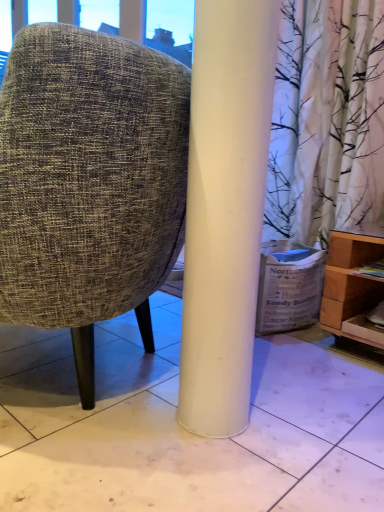
Question: From the image's perspective, would you say white glossy tile at center is positioned over light brown wooden shelf at lower right?

Choices:
 (A) yes
 (B) no

Answer: (B)

Question: Is white glossy tile at center taller than light brown wooden shelf at lower right?

Choices:
 (A) no
 (B) yes

Answer: (A)

Question: Is white glossy tile at center smaller than light brown wooden shelf at lower right?

Choices:
 (A) no
 (B) yes

Answer: (A)

Question: Is white glossy tile at center at the right side of light brown wooden shelf at lower right?

Choices:
 (A) yes
 (B) no

Answer: (B)

Question: Is white glossy tile at center behind light brown wooden shelf at lower right?

Choices:
 (A) yes
 (B) no

Answer: (B)

Question: In the image, is white glossy tile at center on the left side or the right side of light brown wooden shelf at lower right?

Choices:
 (A) right
 (B) left

Answer: (B)

Question: From a real-world perspective, is white glossy tile at center physically located above or below light brown wooden shelf at lower right?

Choices:
 (A) below
 (B) above

Answer: (A)

Question: Looking at their shapes, would you say white glossy tile at center is wider or thinner than light brown wooden shelf at lower right?

Choices:
 (A) wide
 (B) thin

Answer: (A)

Question: In the image, is white glossy tile at center positioned in front of or behind light brown wooden shelf at lower right?

Choices:
 (A) behind
 (B) front

Answer: (B)

Question: From the image's perspective, is white cardboard box at lower right located above or below light brown wooden shelf at lower right?

Choices:
 (A) below
 (B) above

Answer: (B)

Question: Considering the relative positions of white cardboard box at lower right and light brown wooden shelf at lower right in the image provided, is white cardboard box at lower right to the left or to the right of light brown wooden shelf at lower right?

Choices:
 (A) left
 (B) right

Answer: (A)

Question: Based on their sizes in the image, would you say white cardboard box at lower right is bigger or smaller than light brown wooden shelf at lower right?

Choices:
 (A) big
 (B) small

Answer: (B)

Question: Considering the positions of white cardboard box at lower right and light brown wooden shelf at lower right in the image, is white cardboard box at lower right taller or shorter than light brown wooden shelf at lower right?

Choices:
 (A) tall
 (B) short

Answer: (B)

Question: Is white glossy tile at center bigger or smaller than white cardboard box at lower right?

Choices:
 (A) big
 (B) small

Answer: (A)

Question: Is white glossy tile at center situated inside white cardboard box at lower right or outside?

Choices:
 (A) outside
 (B) inside

Answer: (A)